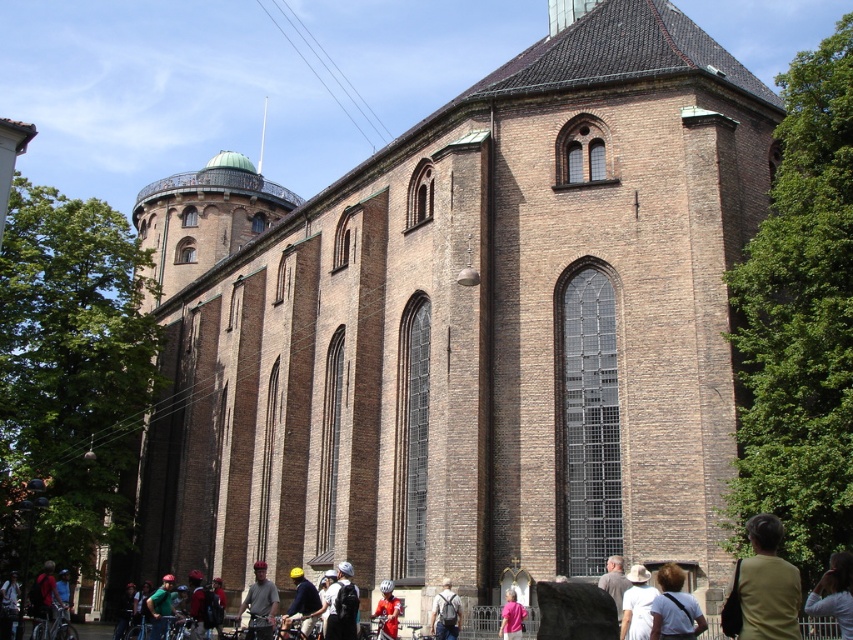
Question: Is white cotton hat at lower center below dark gray backpack at lower center?

Choices:
 (A) yes
 (B) no

Answer: (B)

Question: Which point is farther to the camera?

Choices:
 (A) (289, 573)
 (B) (659, 573)

Answer: (A)

Question: Which is farther from the light brown leather jacket at lower right?

Choices:
 (A) matte black jacket at lower left
 (B) matte yellow helmet at center
 (C) pink fabric at lower center
 (D) dark gray backpack at lower center

Answer: (A)

Question: Observing the image, what is the correct spatial positioning of light brown leather jacket at lower center in reference to pink fabric at lower center?

Choices:
 (A) left
 (B) right

Answer: (B)

Question: Estimate the real-world distances between objects in this image. Which object is closer to the green fabric shirt at lower right?

Choices:
 (A) white cotton hat at lower center
 (B) dark gray backpack at lower center

Answer: (A)

Question: Considering the relative positions of green fabric shirt at lower right and matte black jacket at lower left in the image provided, where is green fabric shirt at lower right located with respect to matte black jacket at lower left?

Choices:
 (A) left
 (B) right

Answer: (B)